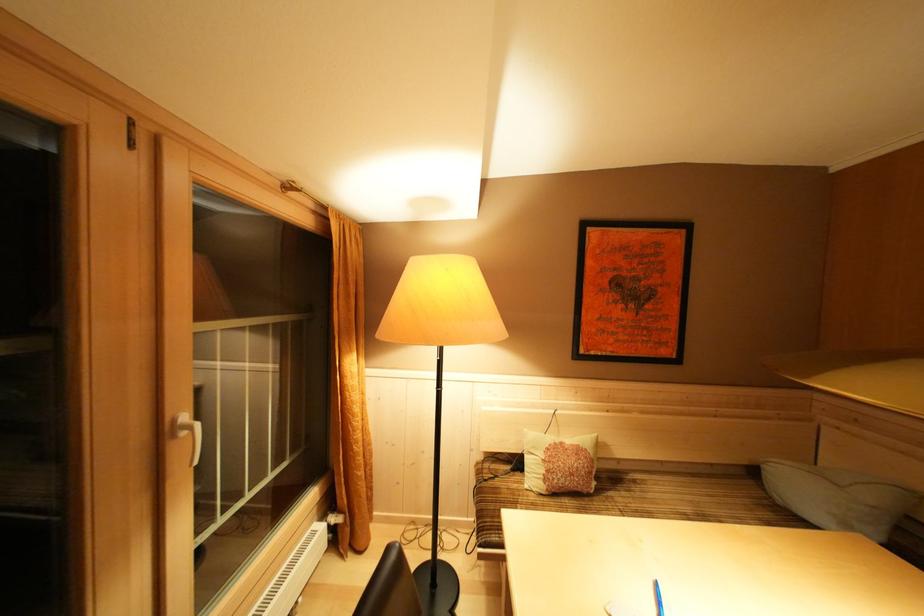
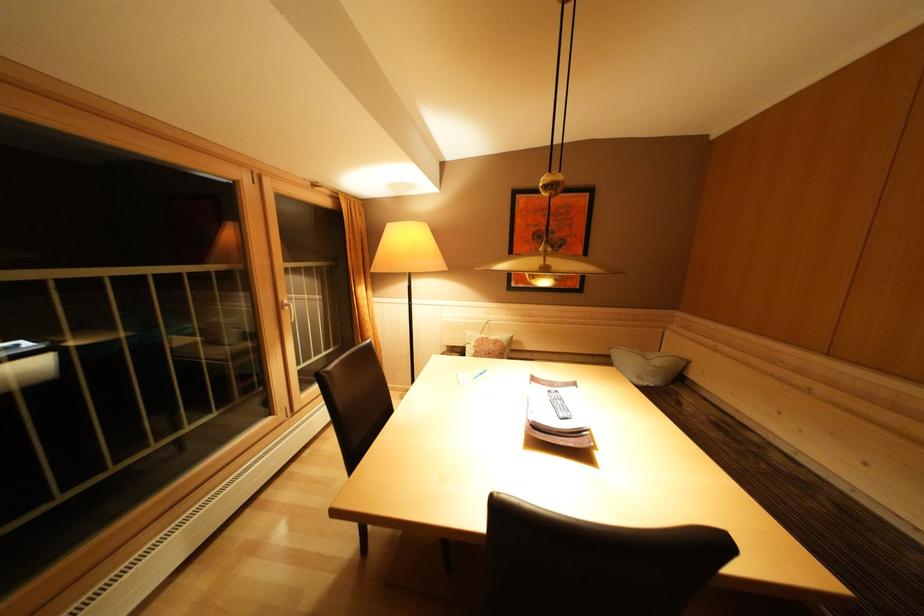
Which direction would the cameraman need to move to produce the second image?

The cameraman moved toward right, backward.